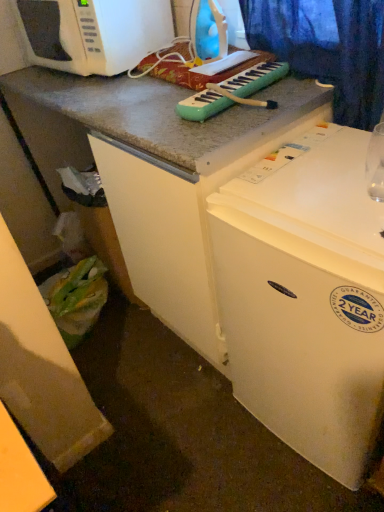
Locate an element on the screen. The image size is (384, 512). blank space situated above white matte refrigerator at upper right (from a real-world perspective) is located at coordinates (331, 179).